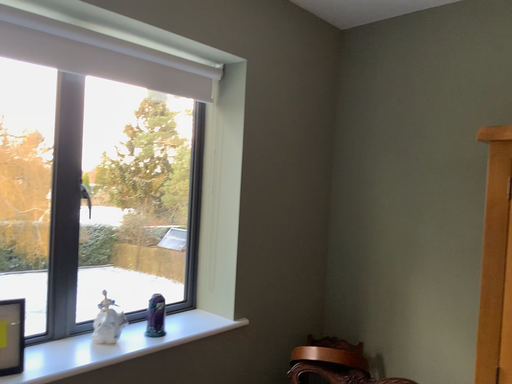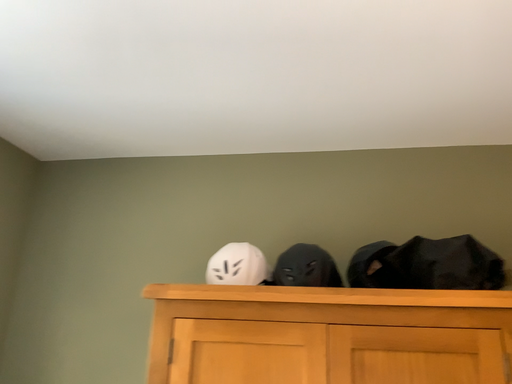
Question: How did the camera likely rotate when shooting the video?

Choices:
 (A) rotated right
 (B) rotated left

Answer: (A)